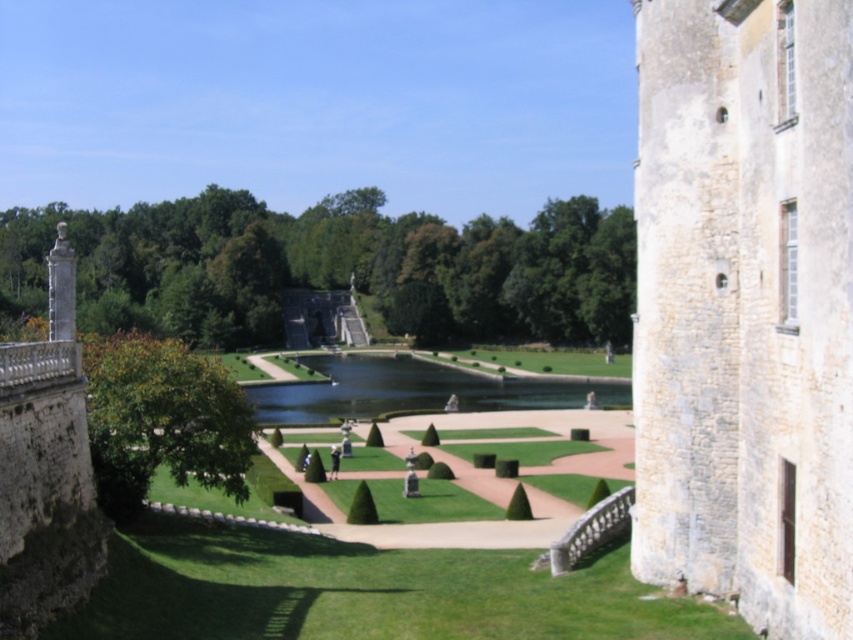
Between green shrubbery at center and green grassy lake at center, which one has less height?

Standing shorter between the two is green grassy lake at center.

Does green shrubbery at center have a greater height compared to green grassy lake at center?

Yes, green shrubbery at center is taller than green grassy lake at center.

The width and height of the screenshot is (853, 640). I want to click on green shrubbery at center, so click(x=335, y=266).

Based on the photo, is stone tower at right to the left of green grassy lake at center from the viewer's perspective?

Incorrect, stone tower at right is not on the left side of green grassy lake at center.

Does stone tower at right have a larger size compared to green grassy lake at center?

Incorrect, stone tower at right is not larger than green grassy lake at center.

This screenshot has width=853, height=640. Describe the element at coordinates (746, 307) in the screenshot. I see `stone tower at right` at that location.

The image size is (853, 640). I want to click on stone tower at right, so click(746, 307).

Does stone tower at right have a smaller size compared to green leafy hedge at lower left?

No.

The height and width of the screenshot is (640, 853). Describe the element at coordinates (746, 307) in the screenshot. I see `stone tower at right` at that location.

Which is in front, point (634, 541) or point (241, 416)?

Point (634, 541) is more forward.

At what (x,y) coordinates should I click in order to perform the action: click on stone tower at right. Please return your answer as a coordinate pair (x, y). Looking at the image, I should click on (x=746, y=307).